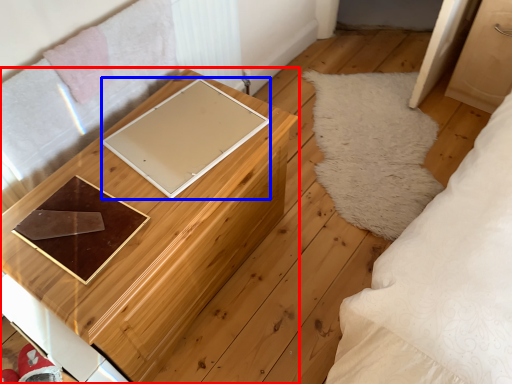
Question: Which object appears farthest to the camera in this image, furniture (highlighted by a red box) or pad (highlighted by a blue box)?

Choices:
 (A) furniture
 (B) pad

Answer: (B)